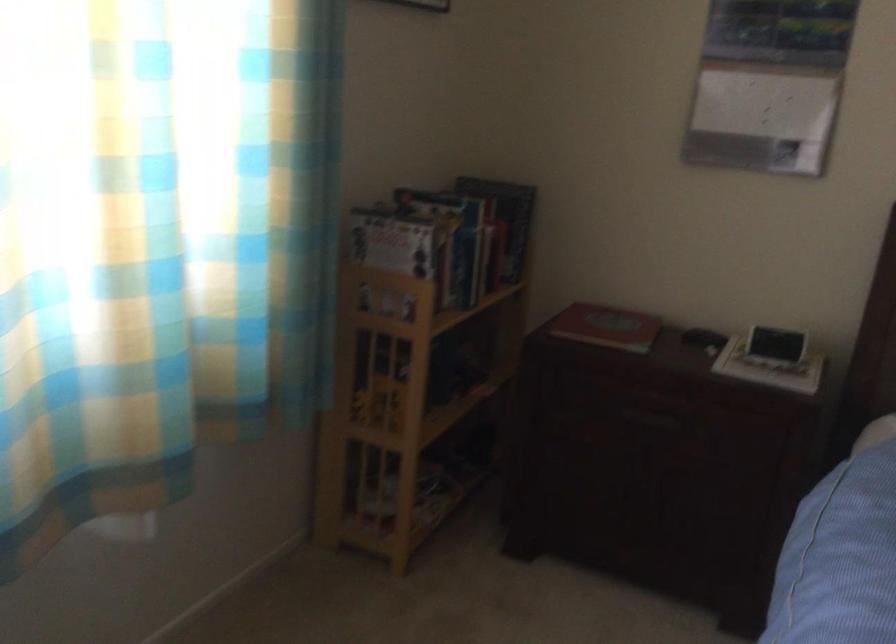
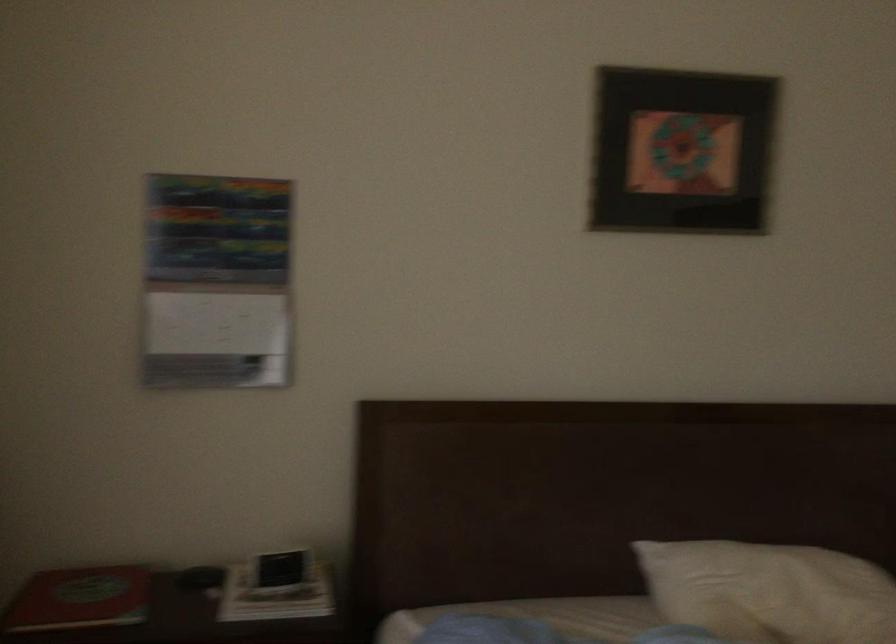
Question: The camera is either moving clockwise (left) or counter-clockwise (right) around the object. The first image is from the beginning of the video and the second image is from the end. Is the camera moving left or right when shooting the video?

Choices:
 (A) Left
 (B) Right

Answer: (A)